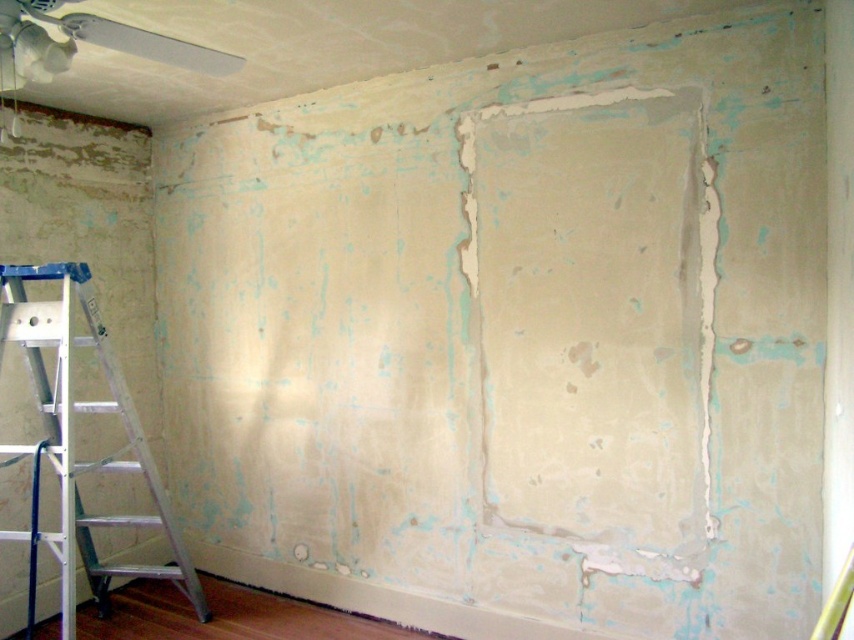
Question: Can you confirm if silver/aluminum ladder at left is thinner than white plastic fan at upper left?

Choices:
 (A) yes
 (B) no

Answer: (B)

Question: Does silver/aluminum ladder at left have a larger size compared to white plastic fan at upper left?

Choices:
 (A) no
 (B) yes

Answer: (B)

Question: Considering the relative positions of silver/aluminum ladder at left and white plastic fan at upper left in the image provided, where is silver/aluminum ladder at left located with respect to white plastic fan at upper left?

Choices:
 (A) left
 (B) right

Answer: (A)

Question: Which point appears farthest from the camera in this image?

Choices:
 (A) (39, 275)
 (B) (4, 4)

Answer: (A)

Question: Which point is closer to the camera taking this photo?

Choices:
 (A) (45, 6)
 (B) (22, 292)

Answer: (A)